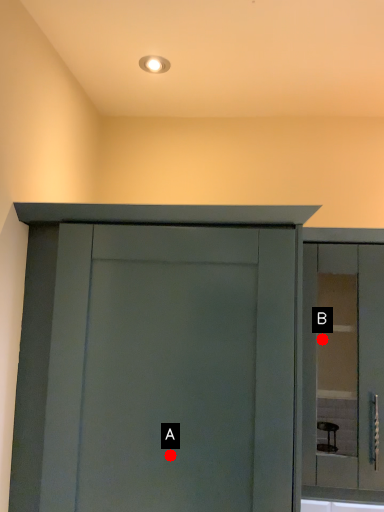
Question: Two points are circled on the image, labeled by A and B beside each circle. Which point is further to the camera?

Choices:
 (A) A is further
 (B) B is further

Answer: (B)